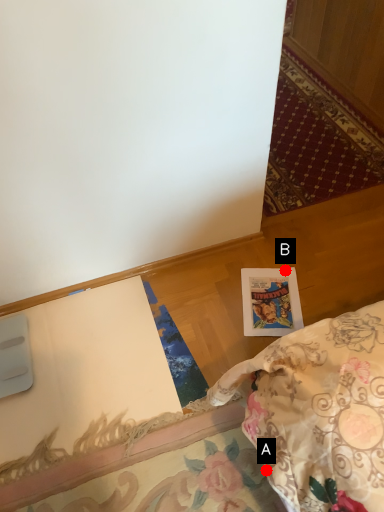
Question: Two points are circled on the image, labeled by A and B beside each circle. Which of the following is the farthest from the observer?

Choices:
 (A) A is further
 (B) B is further

Answer: (B)